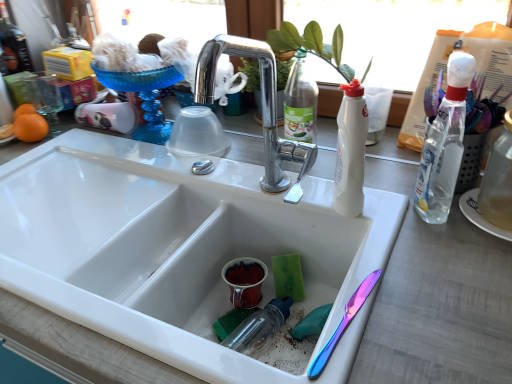
This screenshot has width=512, height=384. Identify the location of free spot behind iridescent metallic knife at lower right. (364, 252).